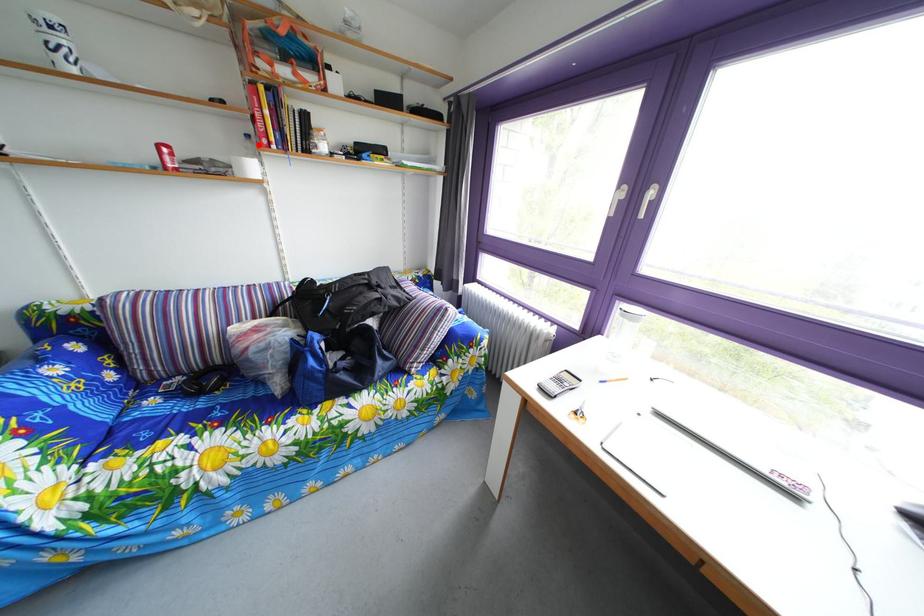
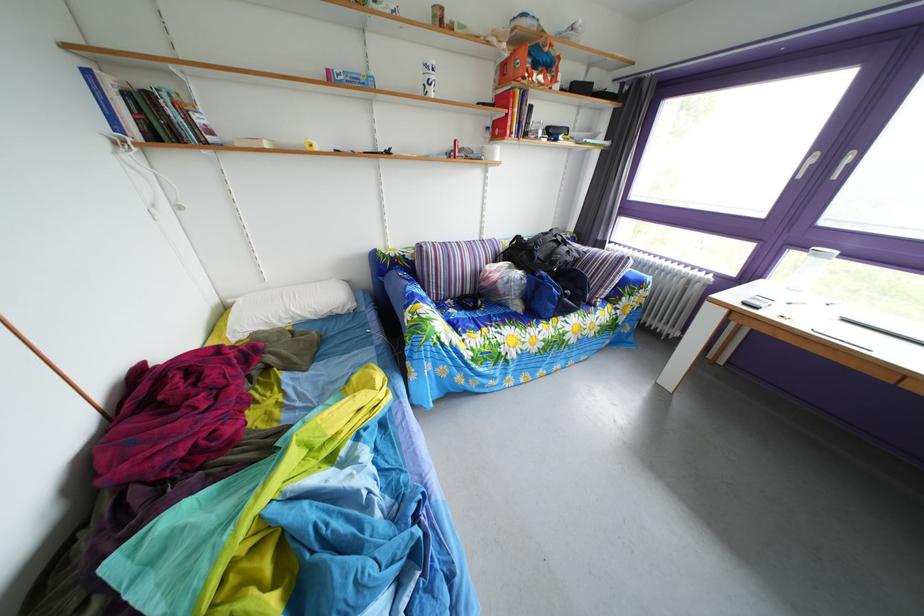
Find the pixel in the second image that matches the highlighted location in the first image.

(499, 137)